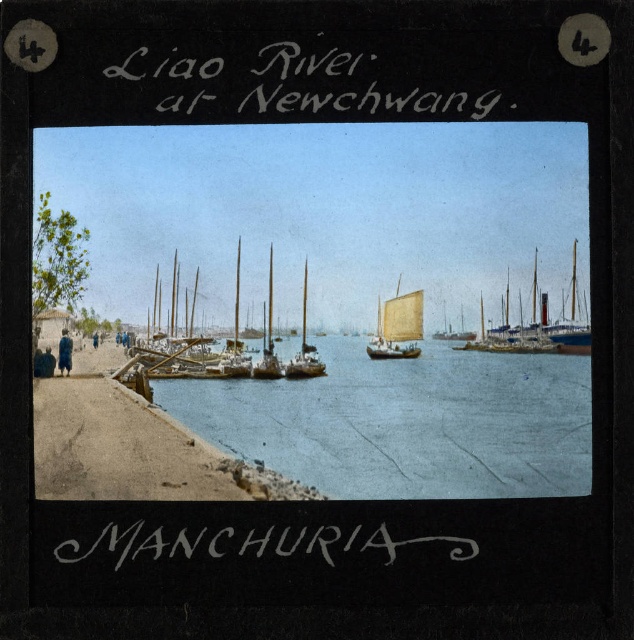
Question: Among these objects, which one is nearest to the camera?

Choices:
 (A) blue wooden sailboat at center
 (B) blue water at center
 (C) wooden sailboat at center
 (D) white sailcloth sailboat at center

Answer: (B)

Question: Is blue wooden sailboat at center closer to camera compared to wooden sailboat at center?

Choices:
 (A) no
 (B) yes

Answer: (B)

Question: Which object is farther from the camera taking this photo?

Choices:
 (A) wooden sailboat at center
 (B) white sailcloth sailboat at center
 (C) blue water at center

Answer: (A)

Question: Among these points, which one is farthest from the camera?

Choices:
 (A) (399, 282)
 (B) (538, 253)
 (C) (441, 442)

Answer: (A)

Question: Is blue wooden sailboat at center wider than white sailcloth sailboat at center?

Choices:
 (A) yes
 (B) no

Answer: (A)

Question: Is blue water at center smaller than wooden sailboat at center?

Choices:
 (A) no
 (B) yes

Answer: (A)